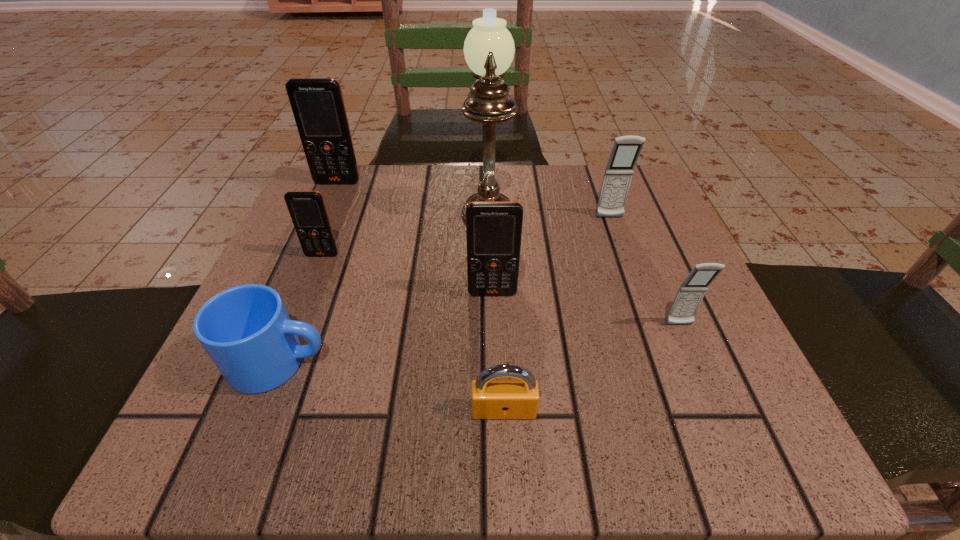
The width and height of the screenshot is (960, 540). In order to click on oil lamp that is at the far edge in this screenshot , I will do `click(489, 48)`.

Locate an element on the screen. The width and height of the screenshot is (960, 540). object at the near edge is located at coordinates (491, 398).

Where is `mug positioned at the left edge`? mug positioned at the left edge is located at coordinates (246, 331).

Identify the location of object that is at the far left corner. Image resolution: width=960 pixels, height=540 pixels. (317, 104).

Image resolution: width=960 pixels, height=540 pixels. What are the coordinates of `object that is at the far right corner` in the screenshot? It's located at (626, 149).

Where is `vacant space at the far edge`? The image size is (960, 540). vacant space at the far edge is located at coordinates (449, 212).

Where is `free region at the near edge of the desktop`? free region at the near edge of the desktop is located at coordinates (538, 437).

In the image, there is a desktop. Identify the location of vacant space at the left edge. (348, 238).

Find the location of a particular element. The height and width of the screenshot is (540, 960). free space at the right edge of the desktop is located at coordinates (633, 280).

Where is `free space at the far left corner`? The image size is (960, 540). free space at the far left corner is located at coordinates (379, 196).